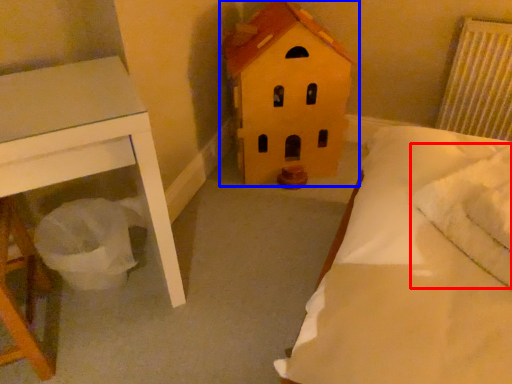
Question: Among these objects, which one is farthest to the camera, pillow (highlighted by a red box) or toy (highlighted by a blue box)?

Choices:
 (A) pillow
 (B) toy

Answer: (B)